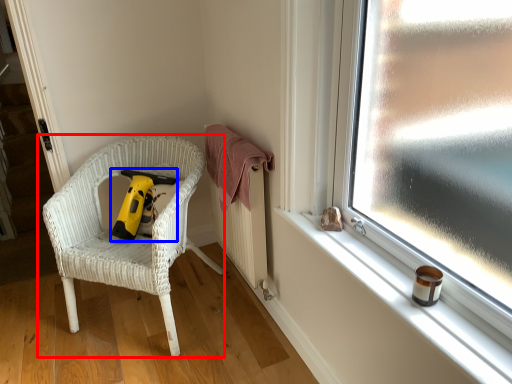
Question: Which object is further to the camera taking this photo, chair (highlighted by a red box) or vacuum (highlighted by a blue box)?

Choices:
 (A) chair
 (B) vacuum

Answer: (B)